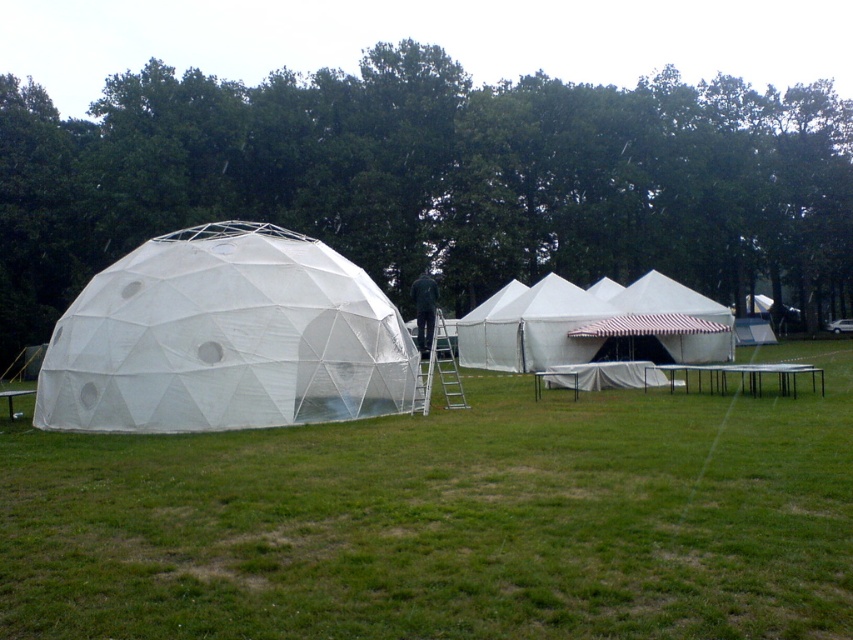
Does green grass at lower center appear on the left side of green leafy tree at upper center?

Correct, you'll find green grass at lower center to the left of green leafy tree at upper center.

You are a GUI agent. You are given a task and a screenshot of the screen. Output one action in this format:
    pyautogui.click(x=<x>, y=<y>)
    Task: Click on the green grass at lower center
    
    Given the screenshot: What is the action you would take?
    (448, 520)

Identify the location of green grass at lower center. (448, 520).

Who is more distant from viewer, (142, 627) or (642, 321)?

Point (642, 321)

You are a GUI agent. You are given a task and a screenshot of the screen. Output one action in this format:
    pyautogui.click(x=<x>, y=<y>)
    Task: Click on the green grass at lower center
    
    Given the screenshot: What is the action you would take?
    pyautogui.click(x=448, y=520)

Is point (292, 477) closer to viewer compared to point (611, 356)?

Yes, point (292, 477) is closer to viewer.

Where is `green grass at lower center`? green grass at lower center is located at coordinates (448, 520).

Looking at this image, can you confirm if green leafy tree at upper center is positioned to the left of white canvas tent at center?

Indeed, green leafy tree at upper center is positioned on the left side of white canvas tent at center.

Between point (660, 163) and point (477, 365), which one is positioned in front?

Point (477, 365) is more forward.

Where is `green leafy tree at upper center`? This screenshot has height=640, width=853. green leafy tree at upper center is located at coordinates (434, 179).